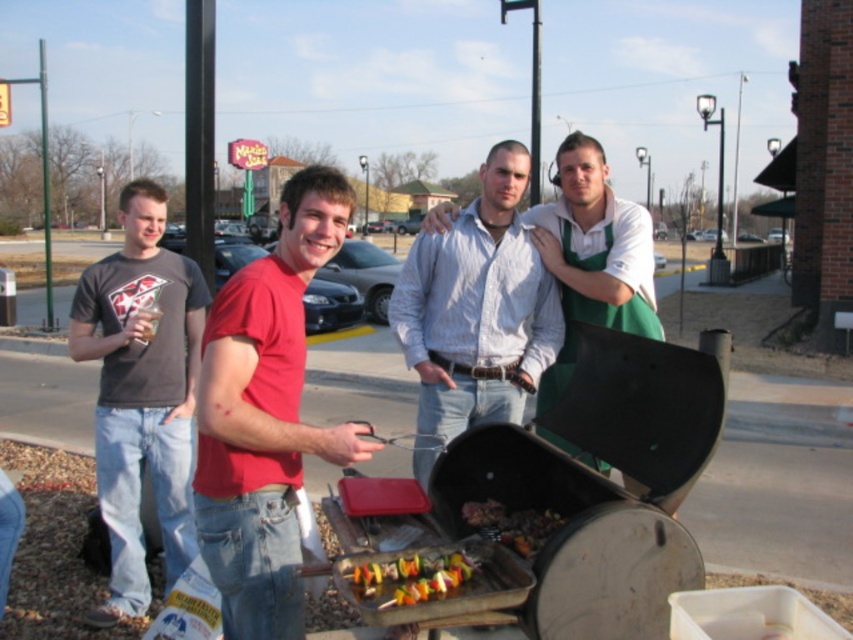
Which of these two, matte gray t-shirt at left or grilled skewers at center, stands shorter?

grilled skewers at center is shorter.

Image resolution: width=853 pixels, height=640 pixels. What are the coordinates of `matte gray t-shirt at left` in the screenshot? It's located at (141, 392).

The image size is (853, 640). What are the coordinates of `matte gray t-shirt at left` in the screenshot? It's located at (141, 392).

Is black matte barbecue grill at center wider than white textured shirt at center?

Yes, black matte barbecue grill at center is wider than white textured shirt at center.

Based on the photo, between black matte barbecue grill at center and white textured shirt at center, which one is positioned higher?

Positioned higher is white textured shirt at center.

Measure the distance between point [585,412] and camera.

Point [585,412] is 3.31 meters away from camera.

Locate an element on the screen. black matte barbecue grill at center is located at coordinates (555, 502).

The height and width of the screenshot is (640, 853). What do you see at coordinates (555, 502) in the screenshot?
I see `black matte barbecue grill at center` at bounding box center [555, 502].

This screenshot has width=853, height=640. I want to click on black matte barbecue grill at center, so click(555, 502).